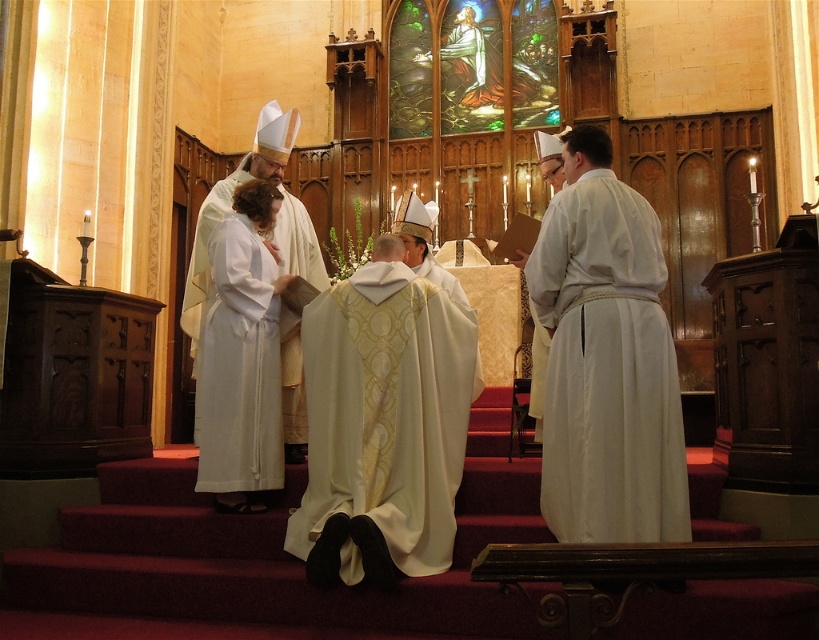
Does point (604, 385) come farther from viewer compared to point (288, 381)?

No, (604, 385) is in front of (288, 381).

Looking at this image, which is below, white matte robe at right or white silk robe at center?

white silk robe at center is lower down.

The image size is (819, 640). In order to click on white matte robe at right in this screenshot , I will do `click(607, 369)`.

Does point (435, 499) lie in front of point (664, 472)?

No.

Which of these two, gold embroidered robe at center or white matte robe at right, stands shorter?

white matte robe at right is shorter.

Does point (374, 296) come in front of point (594, 323)?

No, it is behind (594, 323).

This screenshot has width=819, height=640. Find the location of `gold embroidered robe at center`. gold embroidered robe at center is located at coordinates (382, 426).

Who is lower down, gold embroidered robe at center or white satin robe at center?

gold embroidered robe at center

Is point (295, 529) closer to viewer compared to point (206, 333)?

Yes, it is.

Does point (385, 561) come in front of point (220, 310)?

Yes, it is in front of point (220, 310).

Identify the location of gold embroidered robe at center. (382, 426).